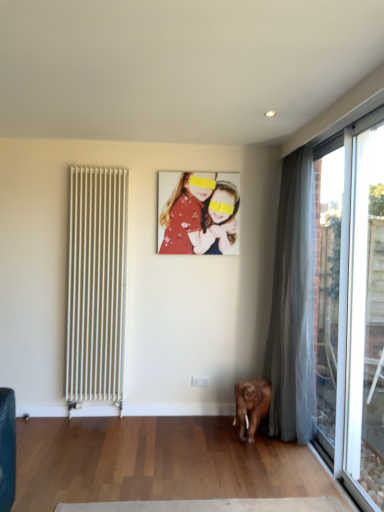
I want to click on transparent glass window at right, positioned as the 2th window in front-to-back order, so click(x=330, y=286).

In order to face matte floral dress at center, should I rotate leftwards or rightwards?

You should look right and rotate roughly 0.843 degrees.

Locate an element on the screen. transparent glass door at right, the 2th window from the back is located at coordinates (366, 325).

Is silky gray curtain at right positioned with its back to transparent glass window at right, positioned as the 2th window in front-to-back order?

Yes.

From a real-world perspective, between silky gray curtain at right and transparent glass window at right, positioned as the 2th window in front-to-back order, who is vertically lower?

transparent glass window at right, positioned as the 2th window in front-to-back order.

Does silky gray curtain at right appear on the right side of transparent glass window at right, positioned as the 2th window in front-to-back order?

No.

Who is taller, silky gray curtain at right or transparent glass window at right, the 1th window viewed from the back?

silky gray curtain at right.

Between point (321, 205) and point (271, 367), which one is positioned behind?

The point (321, 205) is farther.

Would you say transparent glass window at right, positioned as the 2th window in front-to-back order, is to the left or to the right of silky gray curtain at right in the picture?

Clearly, transparent glass window at right, positioned as the 2th window in front-to-back order, is on the right of silky gray curtain at right in the image.

How far apart are transparent glass window at right, positioned as the 2th window in front-to-back order, and silky gray curtain at right?

14.31 inches.

Is transparent glass window at right, positioned as the 2th window in front-to-back order, beside silky gray curtain at right?

Answer: No, transparent glass window at right, positioned as the 2th window in front-to-back order, is not in contact with silky gray curtain at right.

Does transparent glass door at right, the first window from the front, have a smaller size compared to white metal radiator at left?

Yes, transparent glass door at right, the first window from the front, is smaller than white metal radiator at left.

Between transparent glass door at right, the first window from the front, and white metal radiator at left, which one has less height?

Standing shorter between the two is white metal radiator at left.

How much distance is there between transparent glass door at right, the first window from the front, and white metal radiator at left?

6.76 feet.

In the image, is transparent glass door at right, the 2th window from the back, on the left side or the right side of white metal radiator at left?

From the image, it's evident that transparent glass door at right, the 2th window from the back, is to the right of white metal radiator at left.

Considering the sizes of matte floral dress at center and transparent glass window at right, positioned as the 2th window in front-to-back order, in the image, is matte floral dress at center bigger or smaller than transparent glass window at right, positioned as the 2th window in front-to-back order,?

In the image, matte floral dress at center appears to be smaller than transparent glass window at right, positioned as the 2th window in front-to-back order.

Is matte floral dress at center facing towards transparent glass window at right, the 1th window viewed from the back?

No, matte floral dress at center does not turn towards transparent glass window at right, the 1th window viewed from the back.

Considering the positions of point (207, 254) and point (345, 263), is point (207, 254) closer or farther from the camera than point (345, 263)?

Point (207, 254) is farther from the camera than point (345, 263).

From the picture: Is white metal radiator at left located outside matte floral dress at center?

Yes.

Identify the location of radiator in front of the matte floral dress at center. The height and width of the screenshot is (512, 384). (96, 285).

Can you see white metal radiator at left touching matte floral dress at center?

No, white metal radiator at left is not touching matte floral dress at center.

Who is bigger, white metal radiator at left or matte floral dress at center?

With larger size is white metal radiator at left.

Based on the photo, is silky gray curtain at right at the right side of transparent glass door at right, the first window from the front?

No, silky gray curtain at right is not to the right of transparent glass door at right, the first window from the front.

Can you see silky gray curtain at right touching transparent glass door at right, the 2th window from the back?

No, silky gray curtain at right is not with transparent glass door at right, the 2th window from the back.

Considering the positions of objects silky gray curtain at right and transparent glass door at right, the 2th window from the back, in the image provided, who is in front, silky gray curtain at right or transparent glass door at right, the 2th window from the back,?

transparent glass door at right, the 2th window from the back, is closer to the camera.

Is point (268, 369) closer or farther from the camera than point (361, 380)?

Clearly, point (268, 369) is more distant from the camera than point (361, 380).

Is matte floral dress at center far away from transparent glass door at right, the first window from the front?

Absolutely, matte floral dress at center is distant from transparent glass door at right, the first window from the front.

From a real-world perspective, does matte floral dress at center stand above transparent glass door at right, the 2th window from the back?

Indeed, from a real-world perspective, matte floral dress at center stands above transparent glass door at right, the 2th window from the back.

Would you say matte floral dress at center is outside transparent glass door at right, the first window from the front?

Indeed, matte floral dress at center is completely outside transparent glass door at right, the first window from the front.

Considering the sizes of objects matte floral dress at center and transparent glass door at right, the first window from the front, in the image provided, who is smaller, matte floral dress at center or transparent glass door at right, the first window from the front,?

With smaller size is matte floral dress at center.

Locate an element on the screen. The width and height of the screenshot is (384, 512). curtain behind the transparent glass window at right, positioned as the 2th window in front-to-back order is located at coordinates (293, 305).

Where is `curtain above the transparent glass window at right, positioned as the 2th window in front-to-back order (from the image's perspective)`? This screenshot has width=384, height=512. curtain above the transparent glass window at right, positioned as the 2th window in front-to-back order (from the image's perspective) is located at coordinates (293, 305).

Estimate the real-world distances between objects in this image. Which object is closer to white metal radiator at left, transparent glass window at right, the 1th window viewed from the back, or transparent glass door at right, the first window from the front?

transparent glass window at right, the 1th window viewed from the back.

Based on their spatial positions, is transparent glass door at right, the 2th window from the back, or silky gray curtain at right closer to transparent glass window at right, positioned as the 2th window in front-to-back order?

silky gray curtain at right lies closer to transparent glass window at right, positioned as the 2th window in front-to-back order, than the other object.

When comparing their distances from white metal radiator at left, does transparent glass window at right, positioned as the 2th window in front-to-back order, or silky gray curtain at right seem further?

transparent glass window at right, positioned as the 2th window in front-to-back order, lies further to white metal radiator at left than the other object.

Looking at the image, which one is located further to silky gray curtain at right, white metal radiator at left or transparent glass window at right, positioned as the 2th window in front-to-back order?

The object further to silky gray curtain at right is white metal radiator at left.

From the image, which object appears to be nearer to transparent glass door at right, the first window from the front, white metal radiator at left or transparent glass window at right, positioned as the 2th window in front-to-back order?

transparent glass window at right, positioned as the 2th window in front-to-back order, lies closer to transparent glass door at right, the first window from the front, than the other object.

Looking at the image, which one is located further to silky gray curtain at right, matte floral dress at center or white metal radiator at left?

Among the two, white metal radiator at left is located further to silky gray curtain at right.

Consider the image. Based on their spatial positions, is silky gray curtain at right or matte floral dress at center further from transparent glass door at right, the first window from the front?

matte floral dress at center is positioned further to the anchor transparent glass door at right, the first window from the front.

From the image, which object appears to be nearer to white metal radiator at left, silky gray curtain at right or transparent glass window at right, positioned as the 2th window in front-to-back order?

silky gray curtain at right lies closer to white metal radiator at left than the other object.

Where is `person situated between white metal radiator at left and silky gray curtain at right from left to right`? person situated between white metal radiator at left and silky gray curtain at right from left to right is located at coordinates (198, 213).

This screenshot has width=384, height=512. I want to click on radiator between transparent glass door at right, the first window from the front, and matte floral dress at center, along the z-axis, so click(x=96, y=285).

Identify the location of window between white metal radiator at left and transparent glass door at right, the 2th window from the back, from left to right. The height and width of the screenshot is (512, 384). (330, 286).

You are a GUI agent. You are given a task and a screenshot of the screen. Output one action in this format:
    pyautogui.click(x=<x>, y=<y>)
    Task: Click on the curtain between transparent glass door at right, the first window from the front, and matte floral dress at center, along the z-axis
    This screenshot has height=512, width=384.
    Given the screenshot: What is the action you would take?
    pyautogui.click(x=293, y=305)